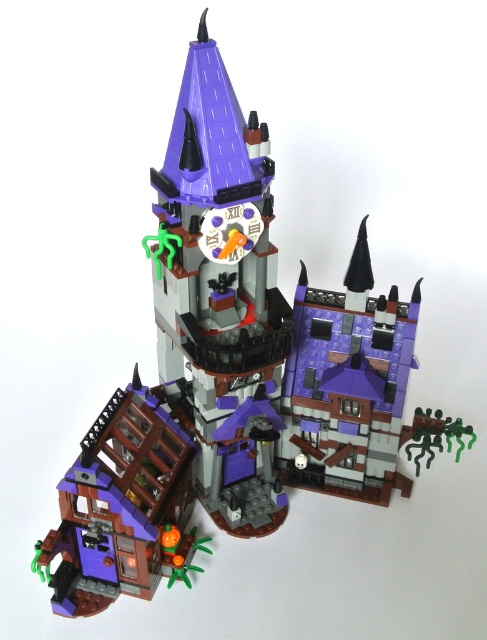
You are a visitor at a LEGO exhibition and want to compare the two purple structures in the haunted castle model. Which one is taller between the purple matte clock tower at center and the matte purple house at lower left?

The purple matte clock tower at center is taller than the matte purple house at lower left according to the description.

In the scene shown: You are a LEGO architect designing a new section for the haunted castle. You need to place a new spooky garden feature exactly at the center of the castle. Given the coordinates of the purple matte clock tower at center, can you determine if it is already positioned at the exact center of the castle?

The purple matte clock tower at center is located at point (221, 296), which indicates it is positioned at the exact center of the castle.